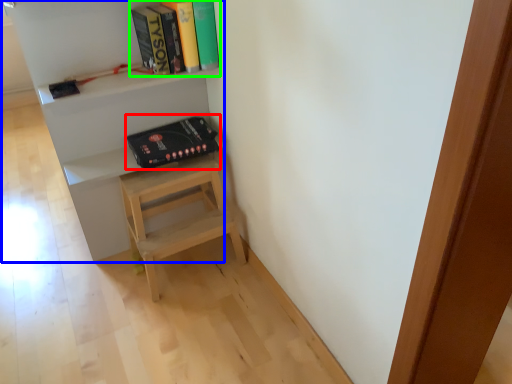
Question: Estimate the real-world distances between objects in this image. Which object is closer to paperback book (highlighted by a red box), shelf (highlighted by a blue box) or book (highlighted by a green box)?

Choices:
 (A) shelf
 (B) book

Answer: (A)